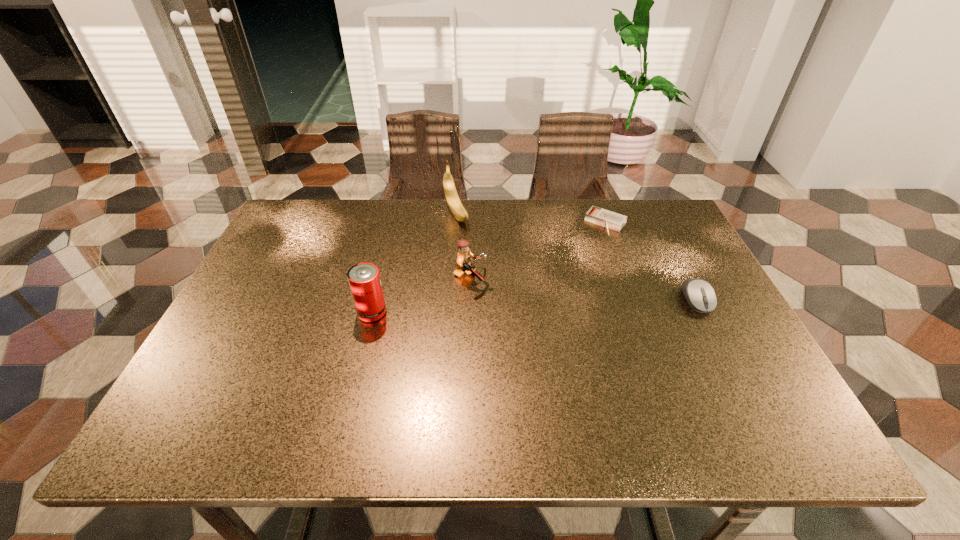
The height and width of the screenshot is (540, 960). I want to click on the leftmost object, so click(364, 280).

Where is `can`? The width and height of the screenshot is (960, 540). can is located at coordinates (364, 280).

You are a GUI agent. You are given a task and a screenshot of the screen. Output one action in this format:
    pyautogui.click(x=<x>, y=<y>)
    Task: Click on the computer equipment
    
    Given the screenshot: What is the action you would take?
    pyautogui.click(x=700, y=295)

Where is `the rightmost object`? the rightmost object is located at coordinates (700, 295).

Where is `Lego`? The height and width of the screenshot is (540, 960). Lego is located at coordinates (464, 255).

This screenshot has width=960, height=540. What are the coordinates of `the tallest object` in the screenshot? It's located at (456, 207).

Find the location of `the second object from right to left`. the second object from right to left is located at coordinates (606, 218).

What are the coordinates of `matchbox` in the screenshot? It's located at (606, 218).

Where is `free space located on the front of the second tallest object`? Image resolution: width=960 pixels, height=540 pixels. free space located on the front of the second tallest object is located at coordinates (365, 343).

Locate an element on the screen. The image size is (960, 540). free spot located 0.230m on the wheel side of the rightmost object is located at coordinates (748, 399).